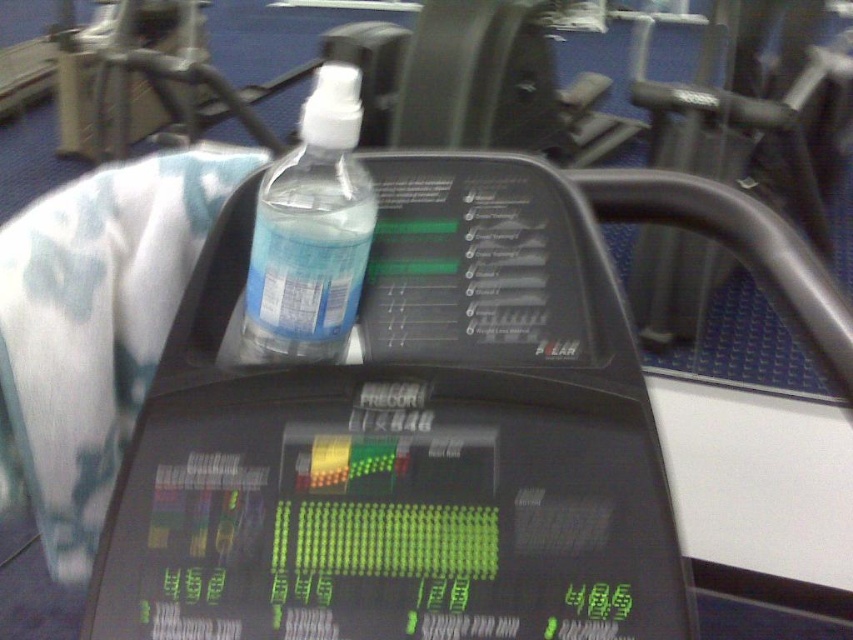
Can you confirm if transparent plastic bottle at upper center is bigger than transparent plastic bottle at center?

Correct, transparent plastic bottle at upper center is larger in size than transparent plastic bottle at center.

Is transparent plastic bottle at upper center above transparent plastic bottle at center?

Actually, transparent plastic bottle at upper center is below transparent plastic bottle at center.

Find the location of a particular element. The height and width of the screenshot is (640, 853). transparent plastic bottle at upper center is located at coordinates (405, 440).